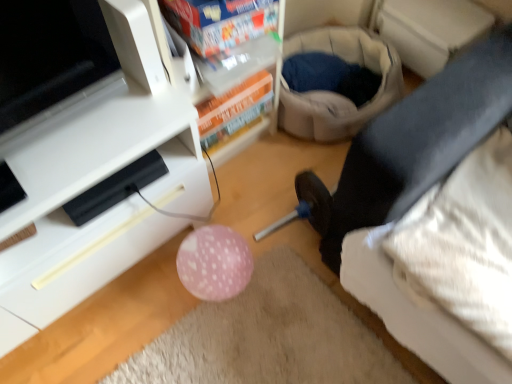
Question: Is white glossy tv stand at lower left closer to camera compared to black fabric leg at lower right?

Choices:
 (A) yes
 (B) no

Answer: (A)

Question: Would you consider white glossy tv stand at lower left to be distant from black fabric leg at lower right?

Choices:
 (A) yes
 (B) no

Answer: (B)

Question: Does white glossy tv stand at lower left appear on the left side of black fabric leg at lower right?

Choices:
 (A) no
 (B) yes

Answer: (B)

Question: Is white glossy tv stand at lower left not within black fabric leg at lower right?

Choices:
 (A) yes
 (B) no

Answer: (A)

Question: Is white glossy tv stand at lower left positioned behind black fabric leg at lower right?

Choices:
 (A) yes
 (B) no

Answer: (B)

Question: Is the surface of white glossy tv stand at lower left in direct contact with black fabric leg at lower right?

Choices:
 (A) yes
 (B) no

Answer: (B)

Question: Is black fabric leg at lower right aimed at white plastic shelf at upper center?

Choices:
 (A) no
 (B) yes

Answer: (A)

Question: Is black fabric leg at lower right positioned beyond the bounds of white plastic shelf at upper center?

Choices:
 (A) yes
 (B) no

Answer: (A)

Question: Considering the relative positions of black fabric leg at lower right and white plastic shelf at upper center in the image provided, is black fabric leg at lower right to the left of white plastic shelf at upper center from the viewer's perspective?

Choices:
 (A) yes
 (B) no

Answer: (B)

Question: Would you say black fabric leg at lower right is a long distance from white plastic shelf at upper center?

Choices:
 (A) no
 (B) yes

Answer: (A)

Question: Is black fabric leg at lower right further to camera compared to white plastic shelf at upper center?

Choices:
 (A) yes
 (B) no

Answer: (A)

Question: Does black fabric leg at lower right have a greater width compared to white plastic shelf at upper center?

Choices:
 (A) yes
 (B) no

Answer: (A)

Question: Can you confirm if white glossy tv stand at lower left is taller than white plastic shelf at upper center?

Choices:
 (A) no
 (B) yes

Answer: (A)